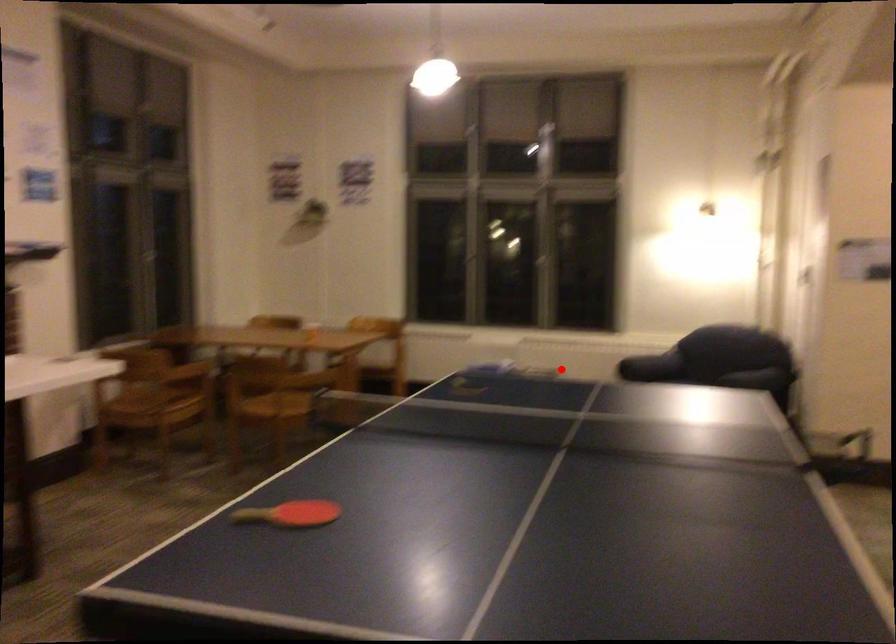
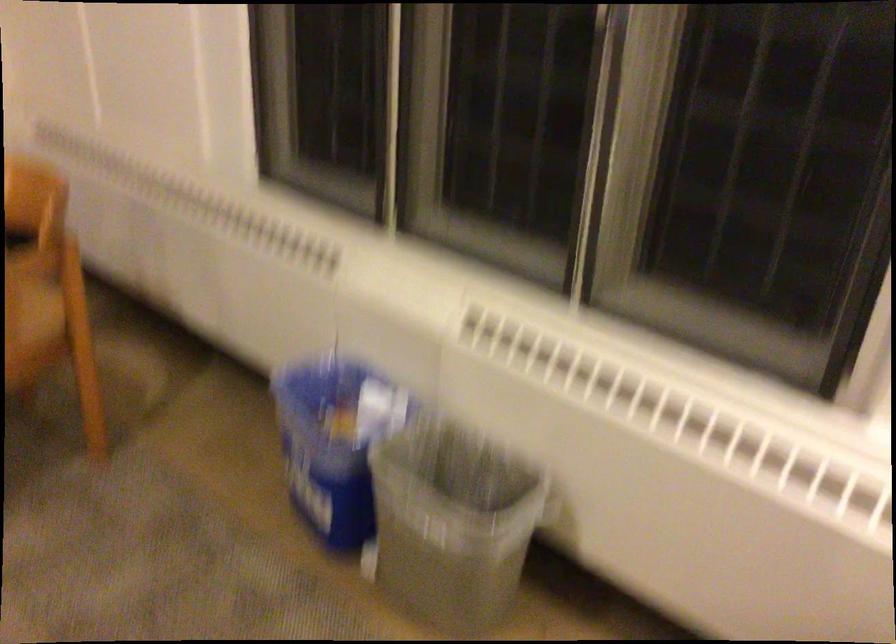
Question: I am providing you with two images of the same scene from different viewpoints. A red point is marked on the first image. At the location where the point appears in image 1, is it still visible in image 2?

Choices:
 (A) Yes
 (B) No

Answer: (A)